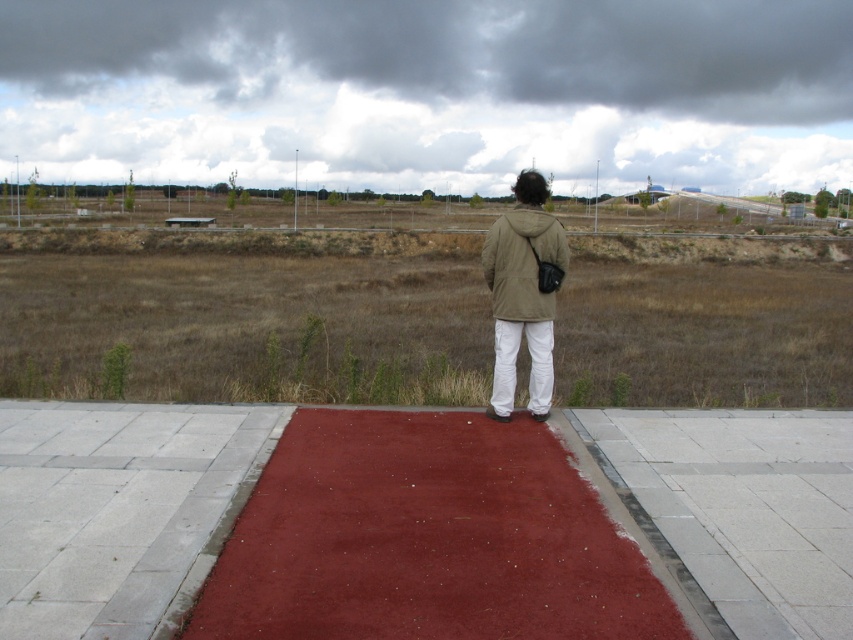
Question: Which of the following is the closest to the observer?

Choices:
 (A) rubberized red mat at center
 (B) khaki matte jacket at center
 (C) matte khaki jacket at center
 (D) smooth concrete pavement at lower center

Answer: (D)

Question: Which of the following is the farthest from the observer?

Choices:
 (A) (460, 428)
 (B) (195, 490)

Answer: (A)

Question: Does smooth concrete pavement at lower center lie behind khaki matte jacket at center?

Choices:
 (A) no
 (B) yes

Answer: (A)

Question: Is smooth concrete pavement at lower center to the right of matte khaki jacket at center from the viewer's perspective?

Choices:
 (A) yes
 (B) no

Answer: (B)

Question: Which object is positioned farthest from the khaki matte jacket at center?

Choices:
 (A) rubberized red mat at center
 (B) gray concrete pavement at center

Answer: (A)

Question: Is matte khaki jacket at center wider than khaki matte jacket at center?

Choices:
 (A) no
 (B) yes

Answer: (B)